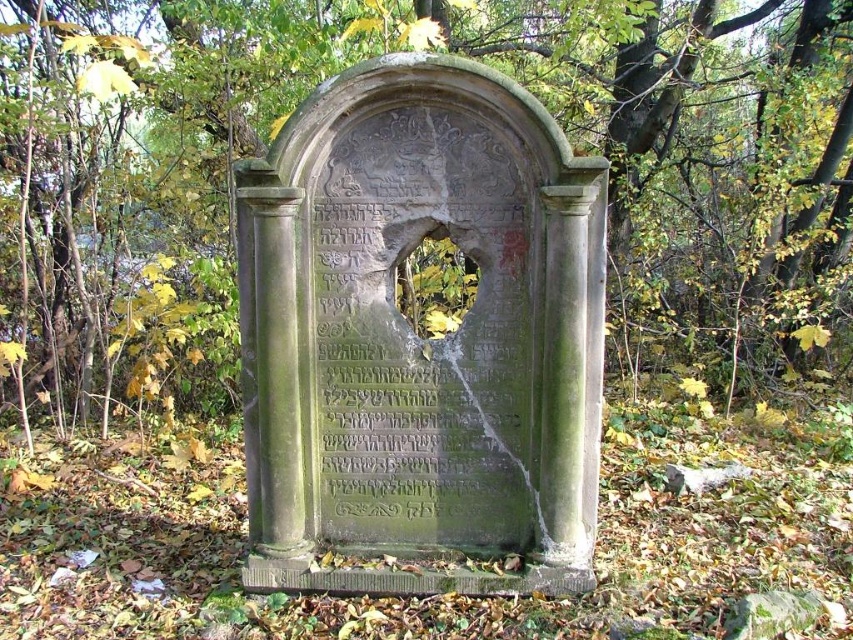
You are a historian examining the green stone tombstone at center and the green stone monument at center. Which one has a greater width?

The green stone tombstone at center has a greater width than the green stone monument at center.

You are an archaeologist examining the scene. You notice two objects labeled as the green stone tombstone at center and the green stone monument at center. Which one do you think is larger in size?

The green stone tombstone at center is bigger than the green stone monument at center according to the description provided.